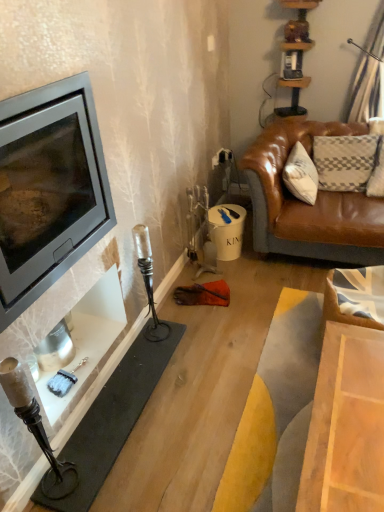
Question: Considering the relative positions of matte black wood burning stove at left and matte black fireplace at left in the image provided, is matte black wood burning stove at left to the left or to the right of matte black fireplace at left?

Choices:
 (A) left
 (B) right

Answer: (A)

Question: Is point click(x=36, y=209) closer or farther from the camera than point click(x=92, y=221)?

Choices:
 (A) closer
 (B) farther

Answer: (A)

Question: Is matte black wood burning stove at left spatially inside matte black fireplace at left, or outside of it?

Choices:
 (A) inside
 (B) outside

Answer: (B)

Question: Do you think matte black fireplace at left is within matte black wood burning stove at left, or outside of it?

Choices:
 (A) inside
 (B) outside

Answer: (B)

Question: Looking at the image, does matte black fireplace at left seem bigger or smaller compared to matte black wood burning stove at left?

Choices:
 (A) big
 (B) small

Answer: (B)

Question: From the image's perspective, relative to matte black wood burning stove at left, is matte black fireplace at left above or below?

Choices:
 (A) below
 (B) above

Answer: (A)

Question: Is matte black fireplace at left taller or shorter than matte black wood burning stove at left?

Choices:
 (A) tall
 (B) short

Answer: (B)